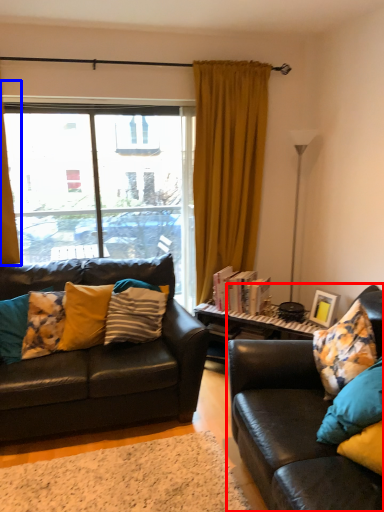
Question: Among these objects, which one is farthest to the camera, studio couch (highlighted by a red box) or curtain (highlighted by a blue box)?

Choices:
 (A) studio couch
 (B) curtain

Answer: (B)